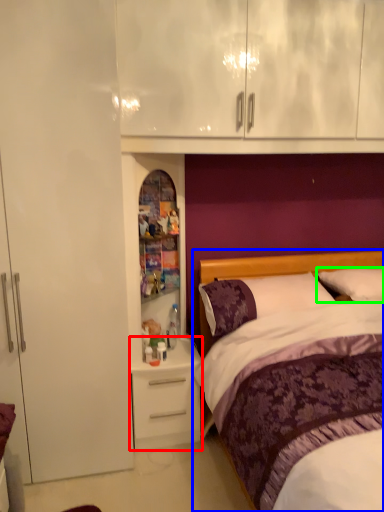
Question: Which object is positioned closest to desk (highlighted by a red box)? Select from bed (highlighted by a blue box) and pillow (highlighted by a green box).

Choices:
 (A) bed
 (B) pillow

Answer: (A)